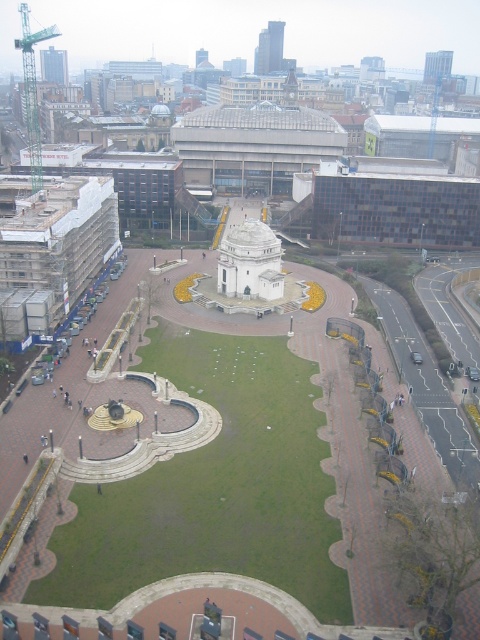
You are a drone operator tasked with flying a drone between the matte glass tower at upper left and the glassy skyscraper at upper right. The drone has a maximum flight distance of 700 feet. Can the drone safely make the trip between these two structures without exceeding its range?

The matte glass tower at upper left and the glassy skyscraper at upper right are 767.88 feet apart. Since the drone has a maximum flight distance of 700 feet, it cannot safely make the trip between these two structures without exceeding its range.

You are standing at the central white dome structure in the plaza and want to reach a specific location. You have two points to choose from, point A at coordinates point (52, 56) and point B at coordinates point (447, 60). Which point is closer to you?

Point point (52, 56) is closer to you because it is in front of point point (447, 60).